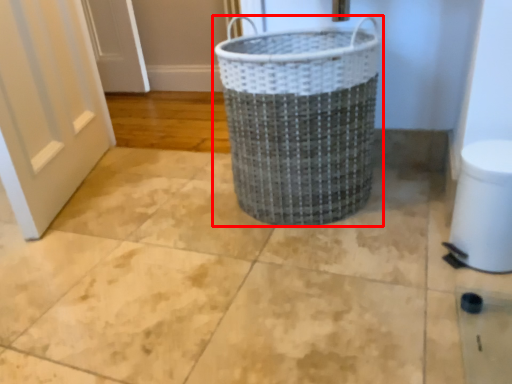
Question: Considering the relative positions of waste container (annotated by the red box) and toilet bowl in the image provided, where is waste container (annotated by the red box) located with respect to the staircase?

Choices:
 (A) left
 (B) right

Answer: (A)